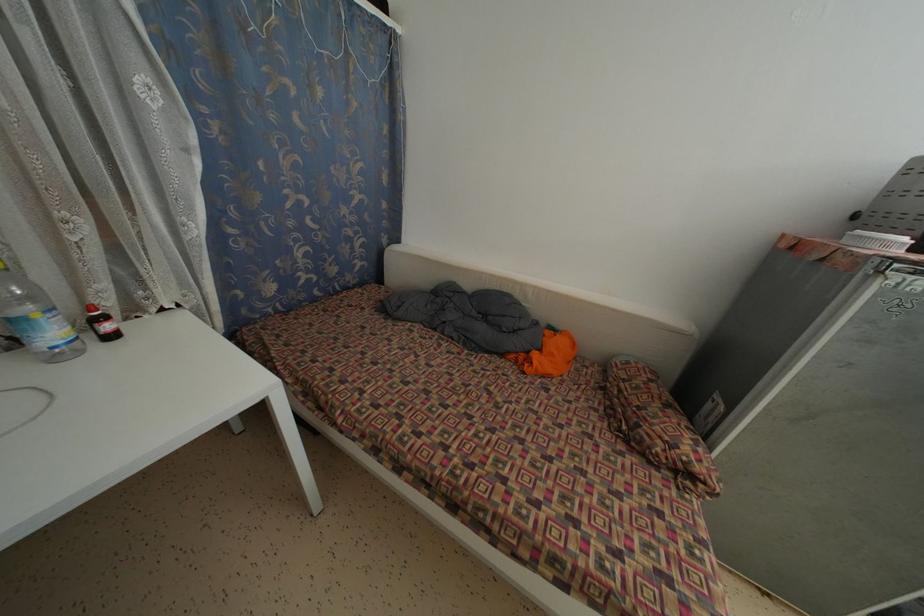
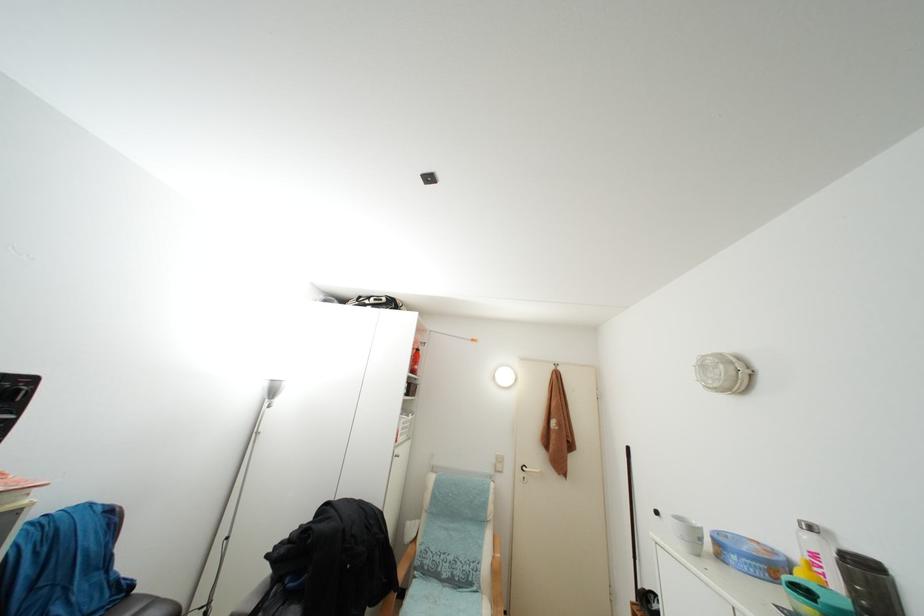
Question: The camera is either moving clockwise (left) or counter-clockwise (right) around the object. The first image is from the beginning of the video and the second image is from the end. Is the camera moving left or right when shooting the video?

Choices:
 (A) Left
 (B) Right

Answer: (A)